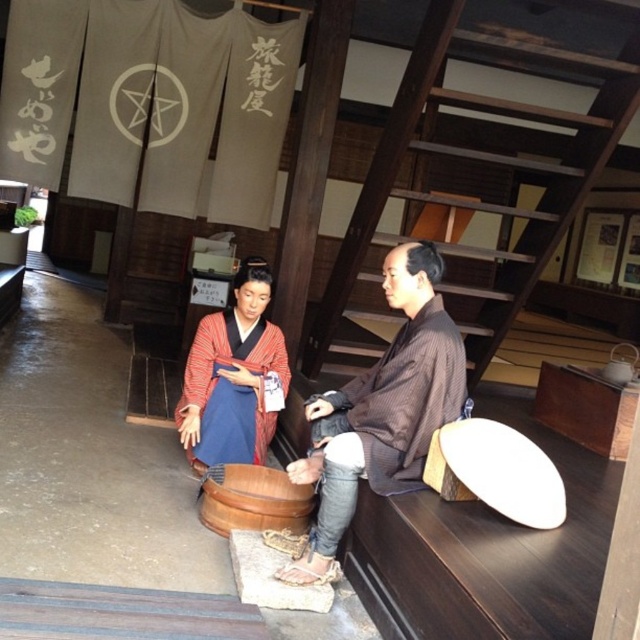
Image resolution: width=640 pixels, height=640 pixels. Describe the element at coordinates (381, 410) in the screenshot. I see `brown striped kimono at center` at that location.

Is brown striped kimono at center taller than matte red kimono at center?

Yes, brown striped kimono at center is taller than matte red kimono at center.

Image resolution: width=640 pixels, height=640 pixels. In order to click on brown striped kimono at center in this screenshot , I will do `click(381, 410)`.

The height and width of the screenshot is (640, 640). In order to click on brown striped kimono at center in this screenshot , I will do `click(381, 410)`.